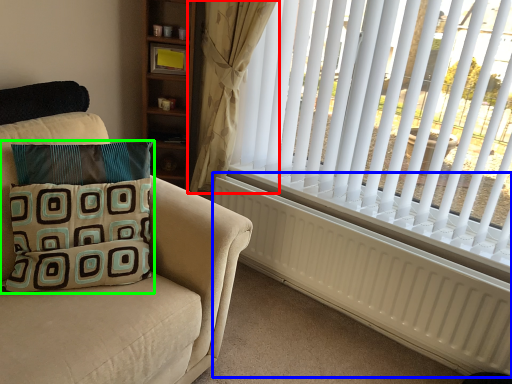
Question: Estimate the real-world distances between objects in this image. Which object is farther from curtain (highlighted by a red box), radiator (highlighted by a blue box) or pillow (highlighted by a green box)?

Choices:
 (A) radiator
 (B) pillow

Answer: (B)